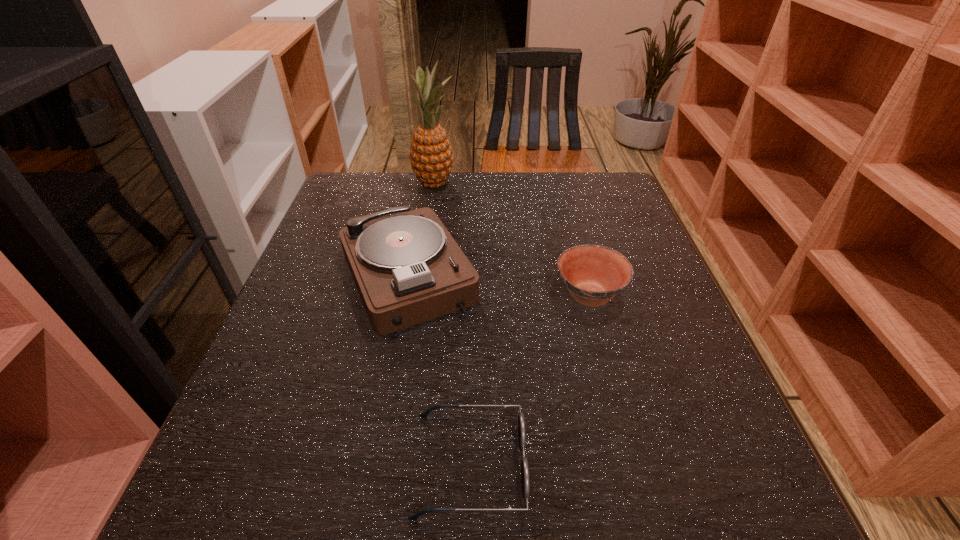
Find the location of a particular element. vacant space situated 0.170m on the front-facing side of the nearest object is located at coordinates (636, 464).

Where is `object located in the far edge section of the desktop`? This screenshot has height=540, width=960. object located in the far edge section of the desktop is located at coordinates (431, 158).

In order to click on object positioned at the near edge in this screenshot , I will do `click(521, 421)`.

The height and width of the screenshot is (540, 960). I want to click on object at the left edge, so click(x=408, y=269).

Where is `object that is at the right edge`? The image size is (960, 540). object that is at the right edge is located at coordinates (594, 274).

In the image, there is a desktop. In order to click on vacant space at the far edge in this screenshot , I will do `click(545, 172)`.

At what (x,y) coordinates should I click in order to perform the action: click on vacant region at the near edge of the desktop. Please return your answer as a coordinate pair (x, y). Looking at the image, I should click on (593, 531).

Locate an element on the screen. vacant space at the left edge of the desktop is located at coordinates (264, 443).

In the image, there is a desktop. Where is `vacant space at the far left corner`? This screenshot has width=960, height=540. vacant space at the far left corner is located at coordinates (361, 185).

Where is `vacant space at the far right corner of the desktop`? The image size is (960, 540). vacant space at the far right corner of the desktop is located at coordinates (610, 195).